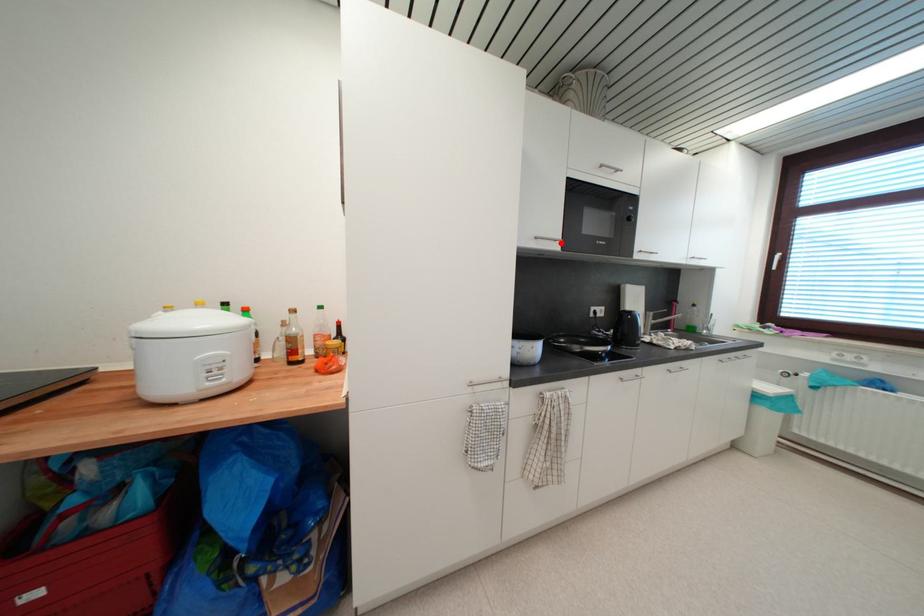
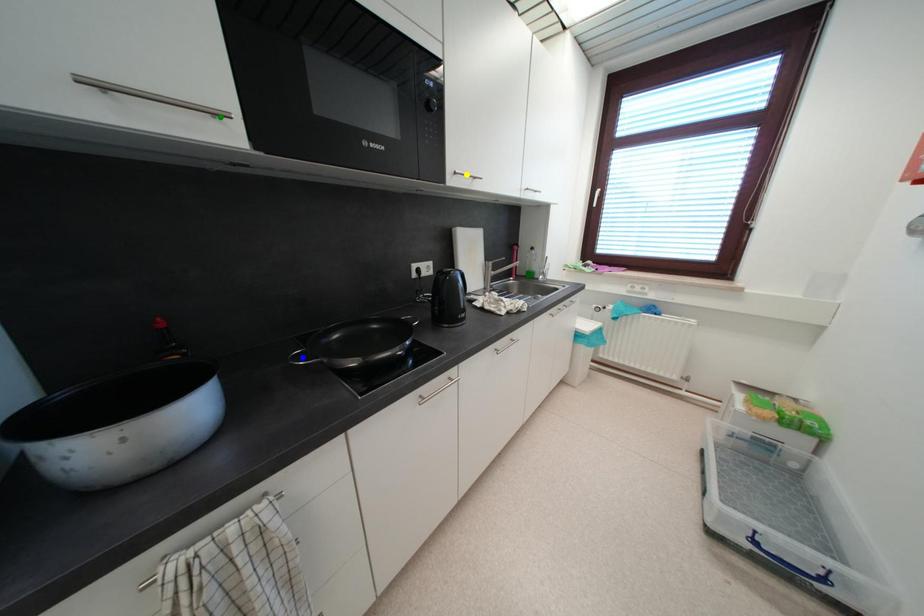
Question: I am providing you with two images of the same scene from different viewpoints. A red point is marked on the first image. You are given multiple points on the second image. Which point in image 2 represents the same 3d spot as the red point in image 1?

Choices:
 (A) yellow point
 (B) blue point
 (C) green point

Answer: (C)